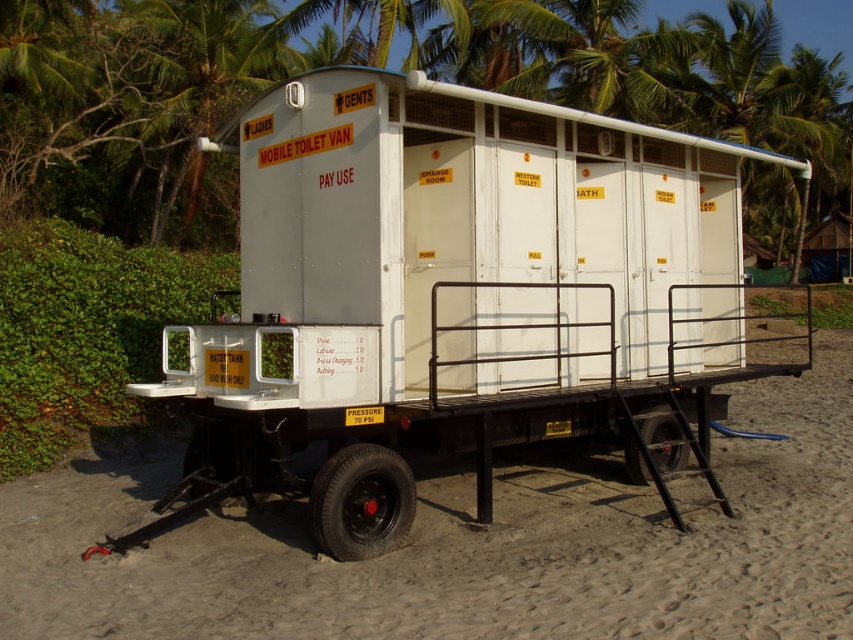
Question: Is white matte mobile toilet van at center to the left of white sand at lower center from the viewer's perspective?

Choices:
 (A) yes
 (B) no

Answer: (A)

Question: Which object appears farthest from the camera in this image?

Choices:
 (A) white matte mobile toilet van at center
 (B) white sand at lower center

Answer: (A)

Question: Is white matte mobile toilet van at center to the right of white sand at lower center from the viewer's perspective?

Choices:
 (A) no
 (B) yes

Answer: (A)

Question: Does white matte mobile toilet van at center appear on the left side of white sand at lower center?

Choices:
 (A) yes
 (B) no

Answer: (A)

Question: Which of the following is the closest to the observer?

Choices:
 (A) white matte mobile toilet van at center
 (B) white sand at lower center

Answer: (B)